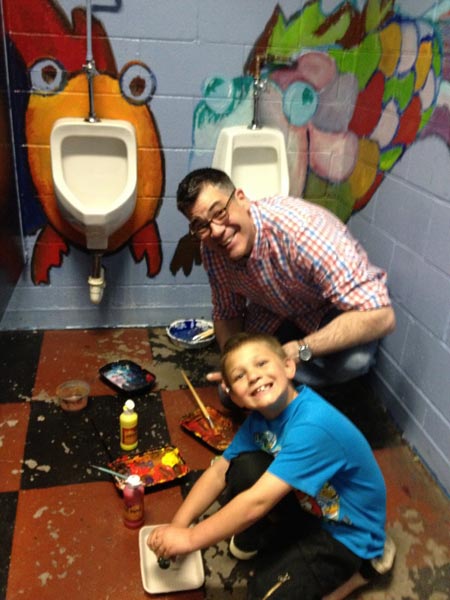
Identify the location of wall. The image size is (450, 600). (191, 131), (423, 191).